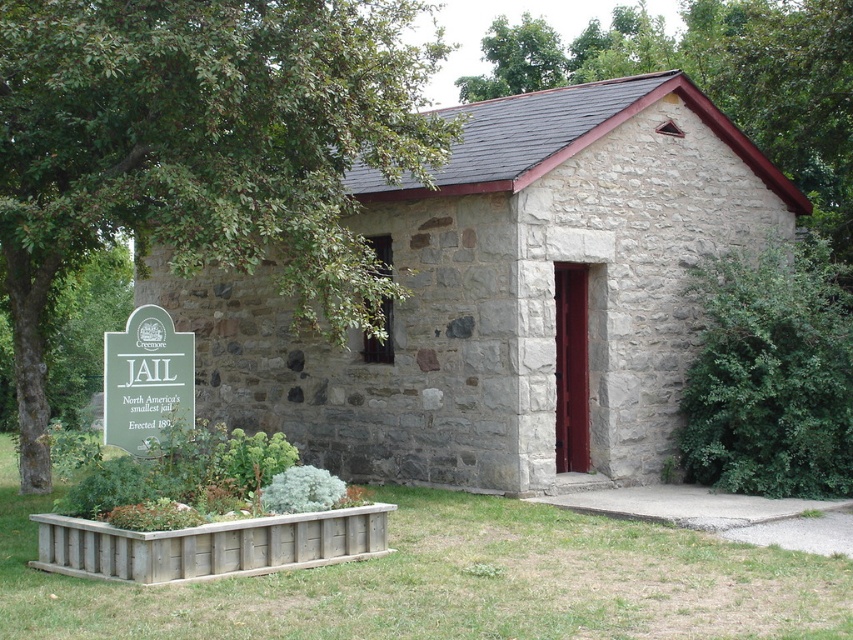
Can you confirm if green leafy tree at upper center is positioned to the left of green leafy bush at right?

No, green leafy tree at upper center is not to the left of green leafy bush at right.

The image size is (853, 640). Find the location of `green leafy tree at upper center`. green leafy tree at upper center is located at coordinates (717, 80).

Locate an element on the screen. This screenshot has width=853, height=640. green leafy tree at upper center is located at coordinates (717, 80).

Which of these two, green leafy tree at upper left or green leafy tree at upper center, stands taller?

green leafy tree at upper center is taller.

Does green leafy tree at upper left have a larger size compared to green leafy tree at upper center?

No, green leafy tree at upper left is not bigger than green leafy tree at upper center.

Between point (293, 193) and point (840, 150), which one is positioned behind?

The point (840, 150) is behind.

Where is `green leafy tree at upper left`? green leafy tree at upper left is located at coordinates (201, 150).

Between green leafy tree at upper left and green leafy bush at right, which one is positioned higher?

Positioned higher is green leafy tree at upper left.

Who is lower down, green leafy tree at upper left or green leafy bush at right?

green leafy bush at right is below.

Is point (44, 257) closer to viewer compared to point (785, 305)?

That is True.

Where is `green leafy tree at upper left`? green leafy tree at upper left is located at coordinates (201, 150).